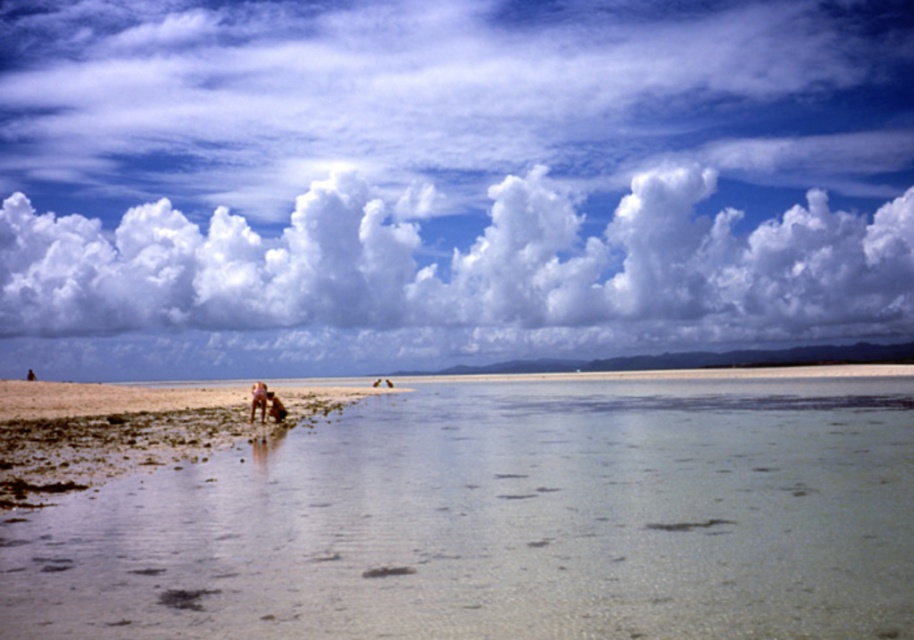
You are standing on the beach and see the clear glass water at center. If you walk towards the point marked at coordinates [505,522], will you enter the water?

The point at coordinates [505,522] corresponds to clear glass water at center, so yes, walking towards that point will lead you into the water.

You are standing on the beach and want to place a small flag exactly at the center of the clear glass water at center. According to the coordinates provided, where should you place the flag?

The clear glass water at center is located at point (505,522), so you should place the flag at those coordinates.

You are standing on the beach and looking at the sky. There is a point marked at coordinates (466, 268). What object is located at that point?

The point at (466, 268) indicates a white fluffy cloud at upper center.